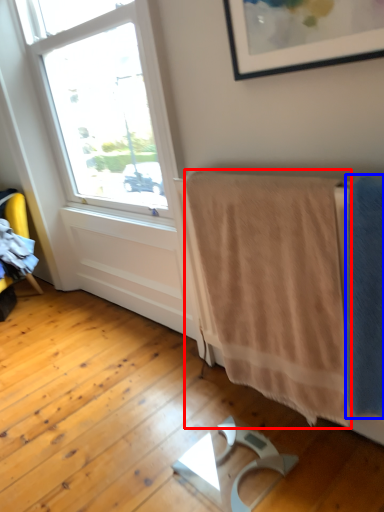
Question: Which point is further to the camera, bath towel (highlighted by a red box) or bath towel (highlighted by a blue box)?

Choices:
 (A) bath towel
 (B) bath towel

Answer: (A)